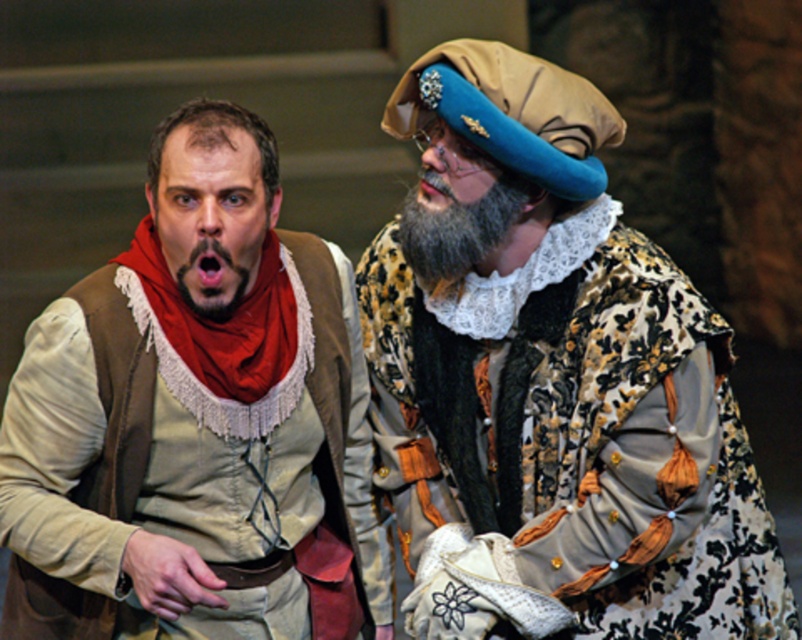
You are standing in front of a historical scene with two costumed individuals. There is a point at coordinates point (582, 253). Can you determine if this point is within a safe distance for taking a closeup photo without disturbing the actors?

The point at point (582, 253) is 3.36 meters from the camera. Since 3.36 meters is a reasonable distance for taking a closeup photo without being too intrusive, it is within a safe distance.

You are an actor in a play and need to adjust your costume. You notice the matte brown vest at left and the dark brown fuzzy beard at left. Which item is closer to the audience?

The matte brown vest at left is in front of the dark brown fuzzy beard at left, so the matte brown vest at left is closer to the audience.